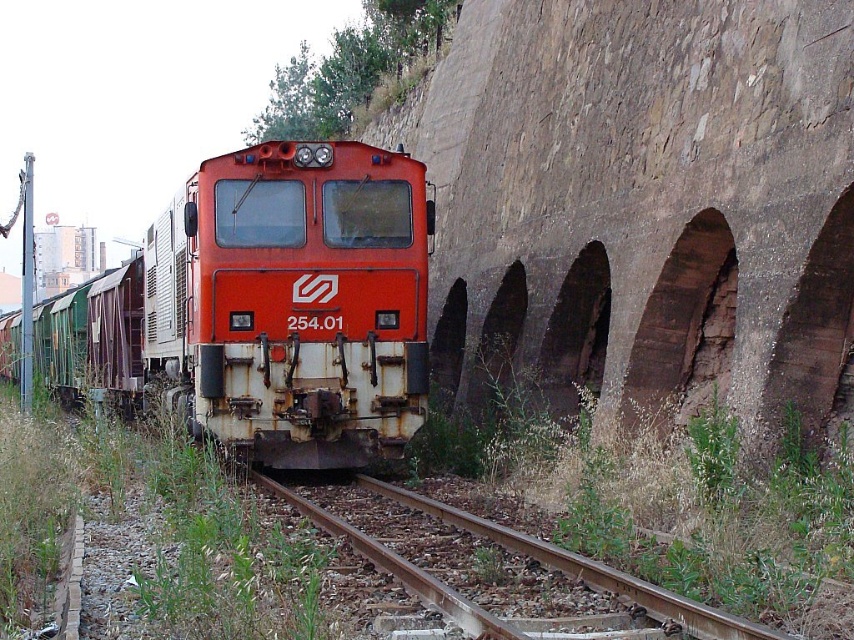
Is point (110, 365) less distant than point (736, 637)?

That is False.

How far apart are rusty metal train at center and brown gravel train track at center?

rusty metal train at center is 12.10 meters away from brown gravel train track at center.

Does point (375, 225) come in front of point (583, 564)?

No, it is not.

This screenshot has width=854, height=640. I want to click on rusty metal train at center, so click(x=287, y=304).